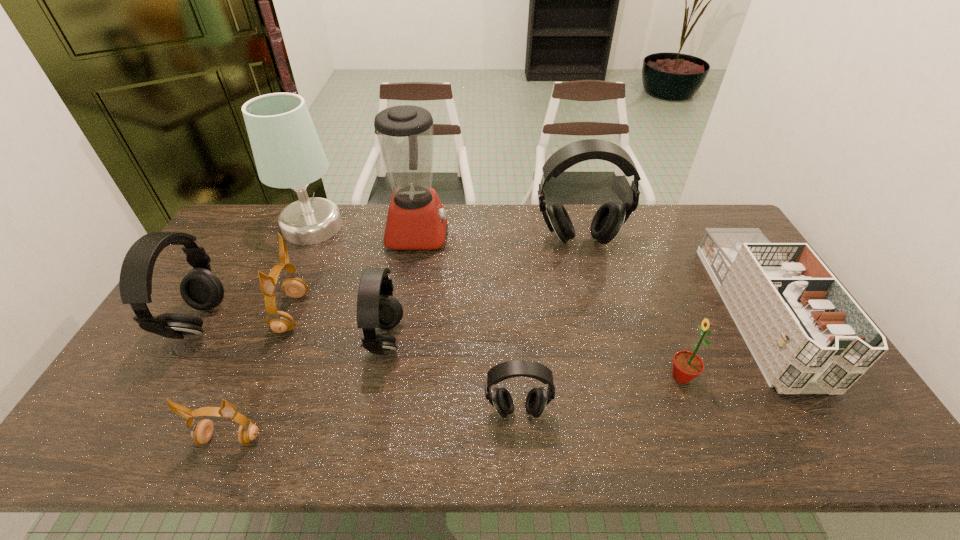
Find the location of a particular element. object located at the right edge is located at coordinates (806, 333).

Find the location of `vacant space at the far edge of the desktop`. vacant space at the far edge of the desktop is located at coordinates (579, 234).

This screenshot has height=540, width=960. Identify the location of vacant space at the near edge of the desktop. (324, 432).

Where is `vacant area at the left edge`? The width and height of the screenshot is (960, 540). vacant area at the left edge is located at coordinates (255, 252).

Where is `vacant space at the near right corner`? vacant space at the near right corner is located at coordinates (844, 443).

Locate an element on the screen. vacant point located between the farther brown earphone and the farthest earphone is located at coordinates (435, 276).

What are the coordinates of `vacant space in between the lampshade and the blender` in the screenshot? It's located at (365, 230).

Identify the location of empty space between the dollhouse and the third black earphone from right to left. (571, 327).

The image size is (960, 540). What are the coordinates of `vacant space that is in between the farthest black earphone and the dollhouse` in the screenshot? It's located at (668, 276).

Where is `unoccupied area between the nearest object and the second black earphone from left to right`? The height and width of the screenshot is (540, 960). unoccupied area between the nearest object and the second black earphone from left to right is located at coordinates (307, 389).